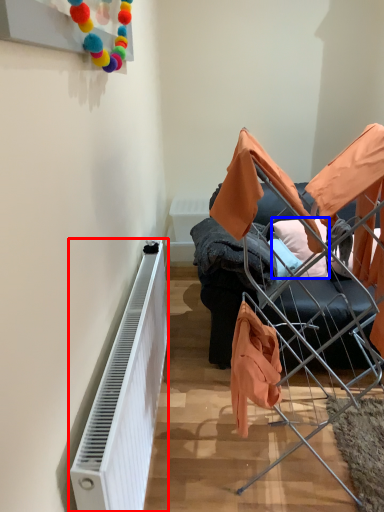
Question: Among these objects, which one is farthest to the camera, radiator (highlighted by a red box) or pillow (highlighted by a blue box)?

Choices:
 (A) radiator
 (B) pillow

Answer: (B)